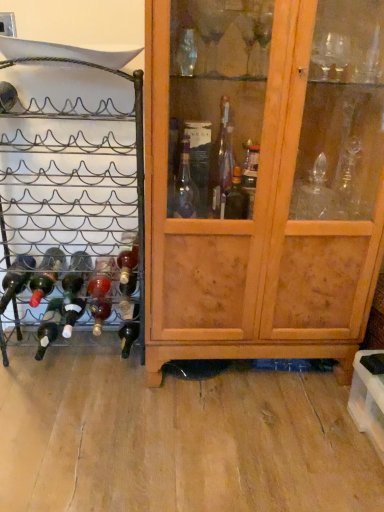
Question: From a real-world perspective, is green matte bottle at lower left, the fourth bottle viewed from the left, positioned above or below matte black wine bottle at left, positioned as the seventh bottle in right-to-left order?

Choices:
 (A) below
 (B) above

Answer: (A)

Question: In terms of width, does green matte bottle at lower left, the 4th bottle viewed from the right, look wider or thinner when compared to matte black wine bottle at left, which is counted as the first bottle, starting from the left?

Choices:
 (A) wide
 (B) thin

Answer: (B)

Question: Which of these objects is positioned closest to the matte black wine bottle at left, which is counted as the first bottle, starting from the left?

Choices:
 (A) dark glass bottle at lower left, which is the sixth bottle in left-to-right order
 (B) black metal wine rack at left
 (C) green matte bottle at lower left, the 4th bottle viewed from the right
 (D) wooden cabinet at center
 (E) translucent glass bottle at center

Answer: (C)

Question: Which object is the closest to the matte glass bottle at lower left, the 5th bottle when ordered from left to right?

Choices:
 (A) matte black wine bottle at left, which is counted as the first bottle, starting from the left
 (B) matte glass bottle at left, placed as the 5th bottle when sorted from right to left
 (C) green matte bottle at lower left, the fourth bottle viewed from the left
 (D) dark glass bottle at lower left, the second bottle in the right-to-left sequence
 (E) translucent glass bottle at center, which is the first bottle from right to left

Answer: (C)